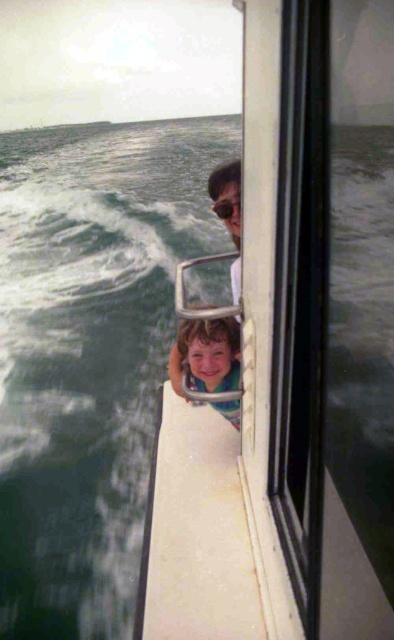
Can you confirm if smooth skin face at center is wider than clear plastic goggles at upper center?

Indeed, smooth skin face at center has a greater width compared to clear plastic goggles at upper center.

What do you see at coordinates (206, 355) in the screenshot? The height and width of the screenshot is (640, 394). I see `smooth skin face at center` at bounding box center [206, 355].

What are the coordinates of `smooth skin face at center` in the screenshot? It's located at (206, 355).